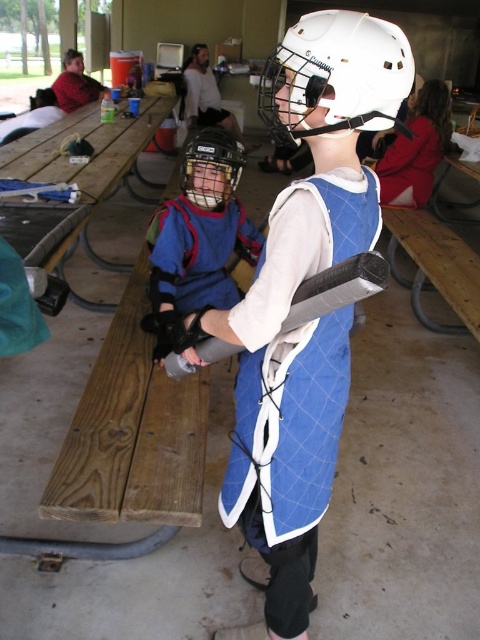
Is white matte helmet at center taller than matte black helmet at center?

Yes, white matte helmet at center is taller than matte black helmet at center.

Does white matte helmet at center come in front of matte black helmet at center?

Yes, white matte helmet at center is closer to the viewer.

Where is `white matte helmet at center`? white matte helmet at center is located at coordinates (336, 76).

What are the coordinates of `white matte helmet at center` in the screenshot? It's located at (336, 76).

Does blue quilted vest at center appear on the left side of white matte helmet at center?

Correct, you'll find blue quilted vest at center to the left of white matte helmet at center.

Does blue quilted vest at center appear over white matte helmet at center?

No.

Where is `blue quilted vest at center`? The image size is (480, 640). blue quilted vest at center is located at coordinates (291, 298).

Locate an element on the screen. The height and width of the screenshot is (640, 480). blue quilted vest at center is located at coordinates (291, 298).

Which is in front, point (312, 188) or point (192, 161)?

Point (312, 188) is more forward.

Locate an element on the screen. This screenshot has width=480, height=640. blue quilted vest at center is located at coordinates (291, 298).

The image size is (480, 640). In order to click on blue quilted vest at center in this screenshot , I will do `click(291, 298)`.